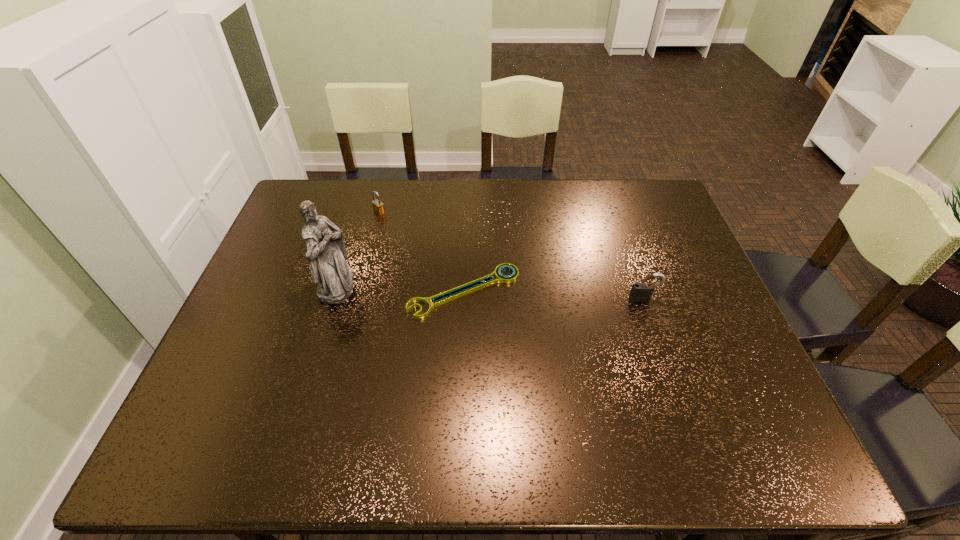
I want to click on figurine, so click(326, 253).

In order to click on the right padlock in this screenshot , I will do `click(640, 292)`.

Find the location of `the rightmost object`. the rightmost object is located at coordinates (640, 292).

The height and width of the screenshot is (540, 960). Identify the location of the shorter padlock. (378, 207).

This screenshot has height=540, width=960. I want to click on the farthest object, so click(x=378, y=207).

Where is `the third object from left to right`? This screenshot has width=960, height=540. the third object from left to right is located at coordinates (457, 292).

The width and height of the screenshot is (960, 540). Find the location of `the shortest object`. the shortest object is located at coordinates (457, 292).

This screenshot has width=960, height=540. What are the coordinates of `free space located 0.180m on the front-facing side of the figurine` in the screenshot? It's located at click(x=420, y=285).

Where is `free space located 0.100m with the keyhole on the front of the rightmost object`? free space located 0.100m with the keyhole on the front of the rightmost object is located at coordinates 655,332.

Locate an element on the screen. This screenshot has height=540, width=960. free location located 0.070m on the back of the second shortest object is located at coordinates (384, 196).